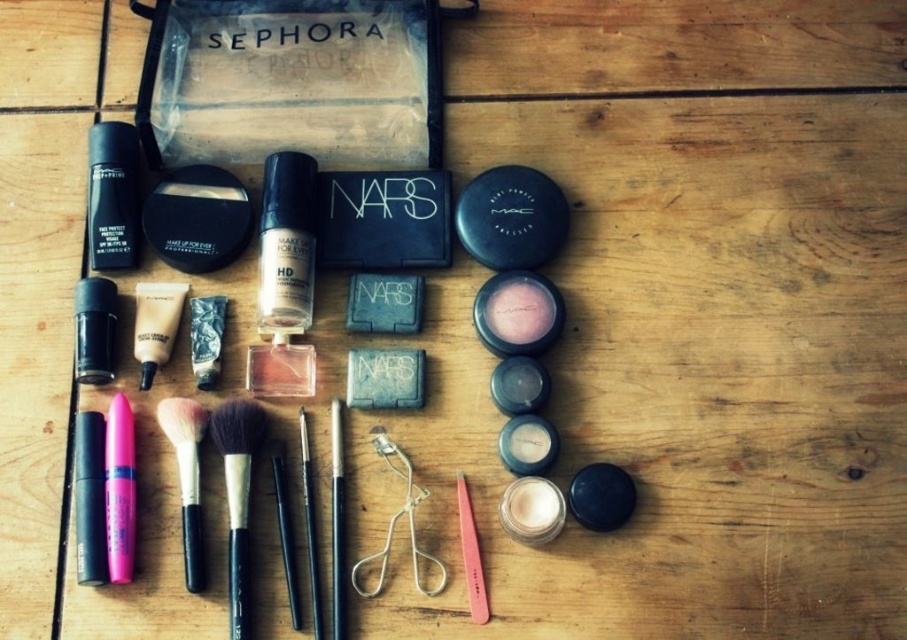
Is white fluffy brush at lower left below matte cream tube at center-left?

Yes, white fluffy brush at lower left is below matte cream tube at center-left.

Identify the location of white fluffy brush at lower left. (187, 480).

Where is `matte black mascara at lower left`? The width and height of the screenshot is (907, 640). matte black mascara at lower left is located at coordinates (94, 330).

Is matte black mascara at lower left shorter than matte pink powder at center-right?

Incorrect, matte black mascara at lower left's height does not fall short of matte pink powder at center-right's.

The width and height of the screenshot is (907, 640). In order to click on matte black mascara at lower left in this screenshot , I will do `click(94, 330)`.

This screenshot has width=907, height=640. I want to click on matte black mascara at lower left, so click(94, 330).

Which is above, matte pink powder at center-right or satin white powder at center?

matte pink powder at center-right

The image size is (907, 640). Identify the location of matte pink powder at center-right. (519, 310).